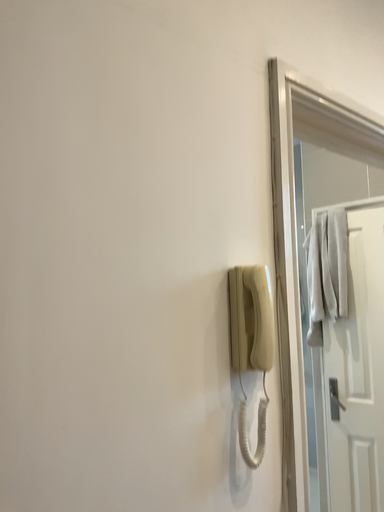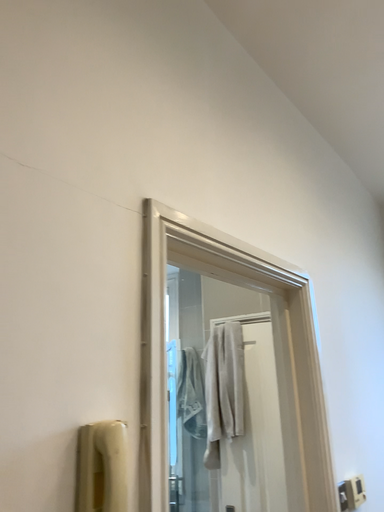
Question: Which way did the camera rotate in the video?

Choices:
 (A) rotated downward
 (B) rotated upward

Answer: (B)